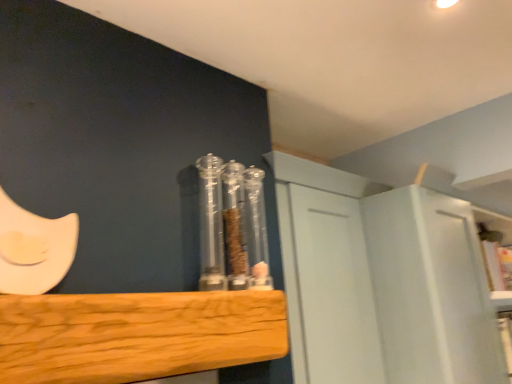
Question: Are natural wood plank at center and white matte cabinet at upper right far apart?

Choices:
 (A) yes
 (B) no

Answer: (B)

Question: Is natural wood plank at center positioned with its back to white matte cabinet at upper right?

Choices:
 (A) yes
 (B) no

Answer: (B)

Question: Is natural wood plank at center behind white matte cabinet at upper right?

Choices:
 (A) yes
 (B) no

Answer: (B)

Question: Does natural wood plank at center have a smaller size compared to white matte cabinet at upper right?

Choices:
 (A) no
 (B) yes

Answer: (B)

Question: From the image's perspective, would you say natural wood plank at center is positioned over white matte cabinet at upper right?

Choices:
 (A) no
 (B) yes

Answer: (B)

Question: Considering the relative sizes of natural wood plank at center and white matte cabinet at upper right in the image provided, is natural wood plank at center taller than white matte cabinet at upper right?

Choices:
 (A) no
 (B) yes

Answer: (A)

Question: Considering the relative positions of white matte cabinet at upper right and transparent plastic containers at center in the image provided, is white matte cabinet at upper right to the left of transparent plastic containers at center from the viewer's perspective?

Choices:
 (A) no
 (B) yes

Answer: (A)

Question: From a real-world perspective, is white matte cabinet at upper right under transparent plastic containers at center?

Choices:
 (A) yes
 (B) no

Answer: (A)

Question: From a real-world perspective, is white matte cabinet at upper right positioned over transparent plastic containers at center based on gravity?

Choices:
 (A) yes
 (B) no

Answer: (B)

Question: Considering the relative positions of white matte cabinet at upper right and transparent plastic containers at center in the image provided, is white matte cabinet at upper right to the right of transparent plastic containers at center from the viewer's perspective?

Choices:
 (A) yes
 (B) no

Answer: (A)

Question: Can you confirm if white matte cabinet at upper right is taller than transparent plastic containers at center?

Choices:
 (A) yes
 (B) no

Answer: (A)

Question: From the image's perspective, is white matte cabinet at upper right below transparent plastic containers at center?

Choices:
 (A) yes
 (B) no

Answer: (A)

Question: Is transparent plastic containers at center not within natural wood plank at center?

Choices:
 (A) no
 (B) yes

Answer: (B)